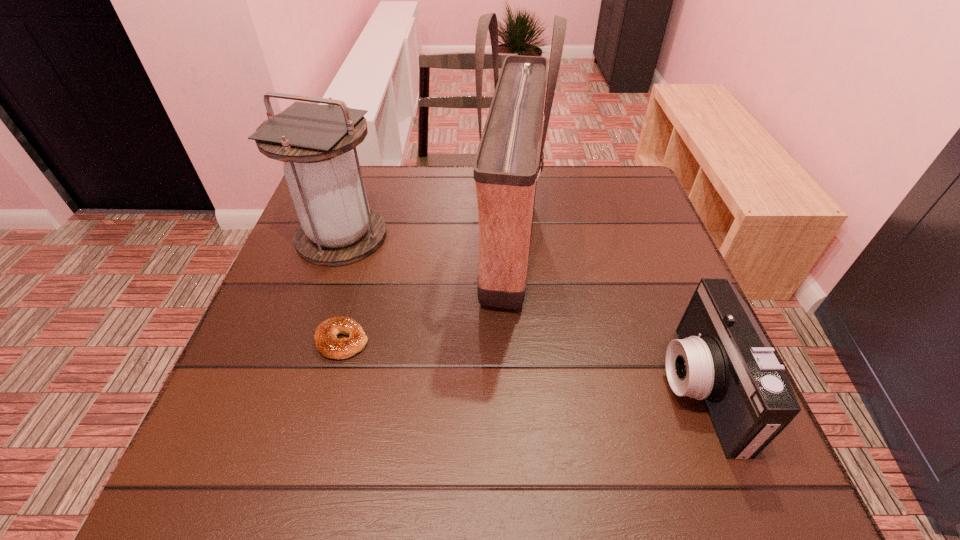
At what (x,y) coordinates should I click in order to perform the action: click on the third object from left to right. Please return your answer as a coordinate pair (x, y). Looking at the image, I should click on (506, 164).

In order to click on the tallest object in this screenshot , I will do `click(506, 164)`.

Locate an element on the screen. Image resolution: width=960 pixels, height=540 pixels. lantern is located at coordinates (337, 227).

The width and height of the screenshot is (960, 540). Identify the location of camcorder. (722, 357).

Find the location of a particular element. This screenshot has width=960, height=540. the rightmost object is located at coordinates (722, 357).

Where is `the shortest object`? the shortest object is located at coordinates (325, 336).

Find the location of a particular element. The image size is (960, 540). blank area located 0.270m on the right of the tallest object is located at coordinates (656, 249).

Locate an element on the screen. vacant space positioned 0.170m on the right of the lantern is located at coordinates (455, 236).

I want to click on free region located 0.060m on the lens of the third tallest object, so click(633, 388).

Image resolution: width=960 pixels, height=540 pixels. I want to click on blank space located 0.290m on the lens of the third tallest object, so click(x=505, y=388).